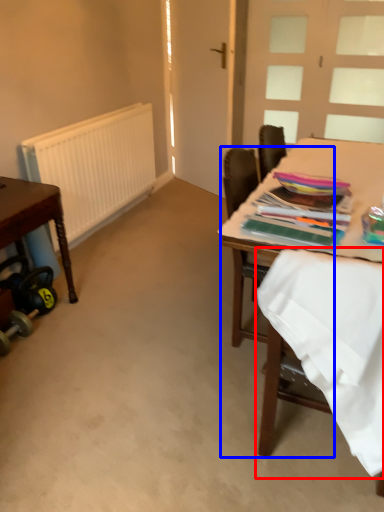
Question: Which object is further to the camera taking this photo, fabric (highlighted by a red box) or chair (highlighted by a blue box)?

Choices:
 (A) fabric
 (B) chair

Answer: (B)